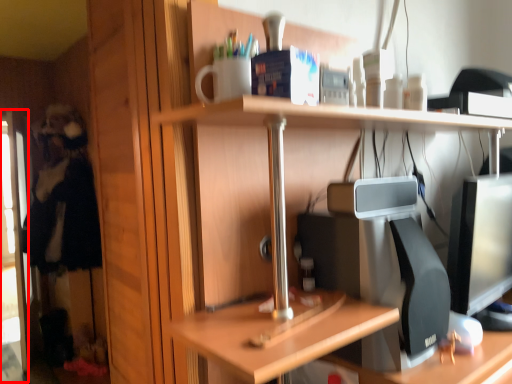
Question: In this image, where is screen door (annotated by the red box) located relative to person?

Choices:
 (A) left
 (B) right

Answer: (A)